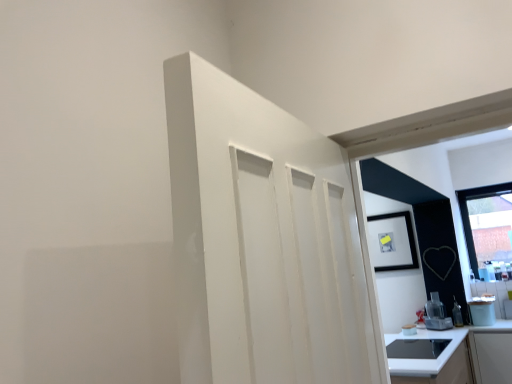
Question: From the image's perspective, is white glossy countertop at lower right positioned above or below satin silver blender at lower right, the 1th appliance positioned from the left?

Choices:
 (A) below
 (B) above

Answer: (A)

Question: Looking at their shapes, would you say white glossy countertop at lower right is wider or thinner than satin silver blender at lower right, the 1th appliance positioned from the left?

Choices:
 (A) wide
 (B) thin

Answer: (A)

Question: Estimate the real-world distances between objects in this image. Which object is closer to the white glossy countertop at lower right?

Choices:
 (A) transparent glass window at upper right
 (B) white glossy coffee maker at right, which ranks as the 1th appliance in right-to-left order
 (C) satin silver blender at lower right, the 1th appliance positioned from the left
 (D) matte black picture frame at upper right

Answer: (B)

Question: Considering the real-world distances, which object is closest to the satin silver blender at lower right, which is the second appliance from right to left?

Choices:
 (A) matte black picture frame at upper right
 (B) transparent glass window at upper right
 (C) white glossy coffee maker at right, which ranks as the 1th appliance in right-to-left order
 (D) white glossy countertop at lower right

Answer: (C)